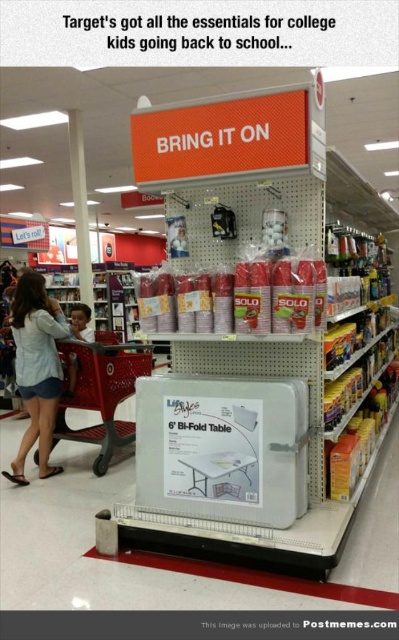
Can you confirm if denim shorts at lower left is bigger than brown leather jacket at lower left?

Yes.

Is point (33, 413) farther from camera compared to point (82, 336)?

No.

Between point (43, 307) and point (92, 333), which one is positioned behind?

The point (92, 333) is behind.

Image resolution: width=399 pixels, height=640 pixels. I want to click on denim shorts at lower left, so click(x=37, y=369).

The height and width of the screenshot is (640, 399). What do you see at coordinates (37, 369) in the screenshot?
I see `denim shorts at lower left` at bounding box center [37, 369].

Can you confirm if denim shorts at lower left is positioned below plastic shopping cart at lower left?

No, denim shorts at lower left is not below plastic shopping cart at lower left.

This screenshot has width=399, height=640. What are the coordinates of `denim shorts at lower left` in the screenshot? It's located at (37, 369).

Locate an element on the screen. This screenshot has height=640, width=399. denim shorts at lower left is located at coordinates (37, 369).

Is plastic shopping cart at lower left bigger than brown leather jacket at lower left?

Indeed, plastic shopping cart at lower left has a larger size compared to brown leather jacket at lower left.

Is plastic shopping cart at lower left smaller than brown leather jacket at lower left?

Actually, plastic shopping cart at lower left might be larger than brown leather jacket at lower left.

Measure the distance between point (146,369) and camera.

Point (146,369) is 4.62 meters from camera.

Where is `plastic shopping cart at lower left`? The height and width of the screenshot is (640, 399). plastic shopping cart at lower left is located at coordinates click(x=102, y=392).